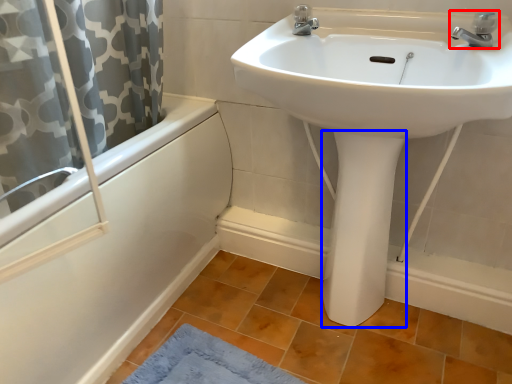
Question: Which object appears closest to the camera in this image, tap (highlighted by a red box) or bidet (highlighted by a blue box)?

Choices:
 (A) tap
 (B) bidet

Answer: (A)